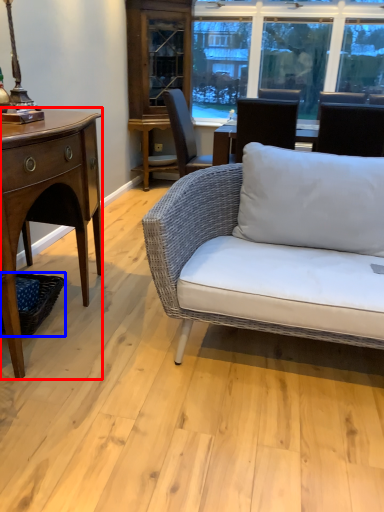
Question: Which object is further to the camera taking this photo, desk (highlighted by a red box) or picnic basket (highlighted by a blue box)?

Choices:
 (A) desk
 (B) picnic basket

Answer: (B)